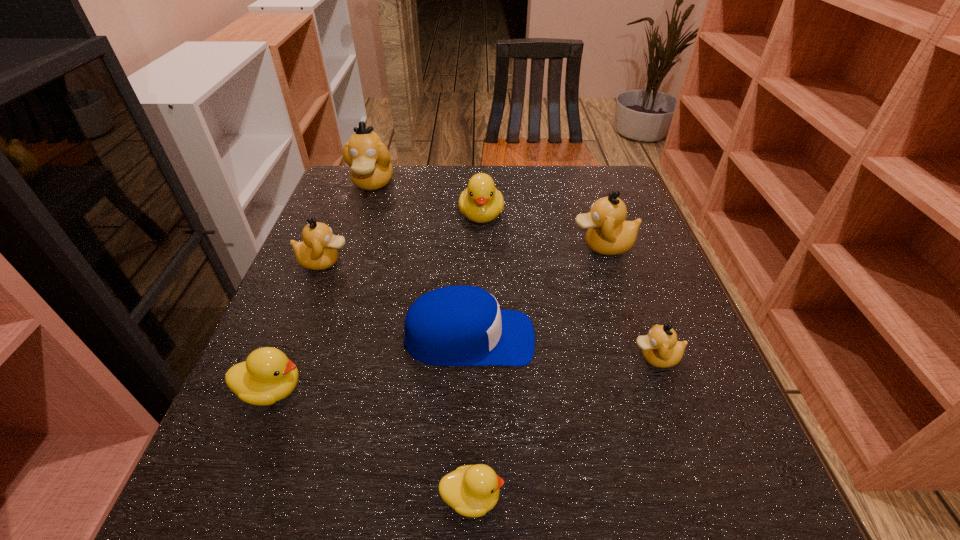
The width and height of the screenshot is (960, 540). Find the location of `the nearest yellow duckling`. the nearest yellow duckling is located at coordinates (471, 490).

Find the location of a particular element. The image size is (960, 540). the smallest yellow duckling is located at coordinates (471, 490).

In order to click on blank space located 0.270m on the face of the biggest tan duckling in this screenshot , I will do `click(344, 268)`.

Identify the location of blank space located 0.250m on the face of the second biggest tan duckling. (466, 246).

Locate an element on the screen. vacant space located 0.380m on the face of the second biggest tan duckling is located at coordinates (411, 246).

At what (x,y) coordinates should I click in order to perform the action: click on vacant space located 0.230m on the face of the second biggest tan duckling. Please return your answer as a coordinate pair (x, y). The image size is (960, 540). Looking at the image, I should click on (474, 246).

Where is `free space located 0.370m on the beak of the biggest yellow duckling`? This screenshot has height=540, width=960. free space located 0.370m on the beak of the biggest yellow duckling is located at coordinates (482, 355).

The image size is (960, 540). I want to click on vacant area situated 0.380m on the face of the third biggest tan duckling, so click(x=517, y=262).

Find the location of a particular element. This screenshot has height=540, width=960. vacant space located on the front-facing side of the blue baseball cap is located at coordinates (561, 339).

The height and width of the screenshot is (540, 960). Identify the location of blank space located 0.390m on the beak of the second farthest yellow duckling. (534, 390).